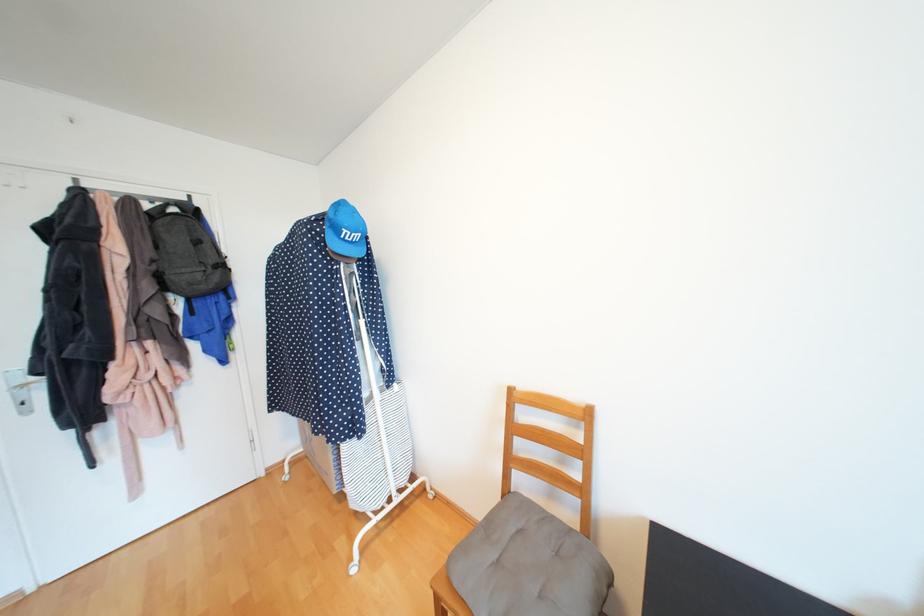
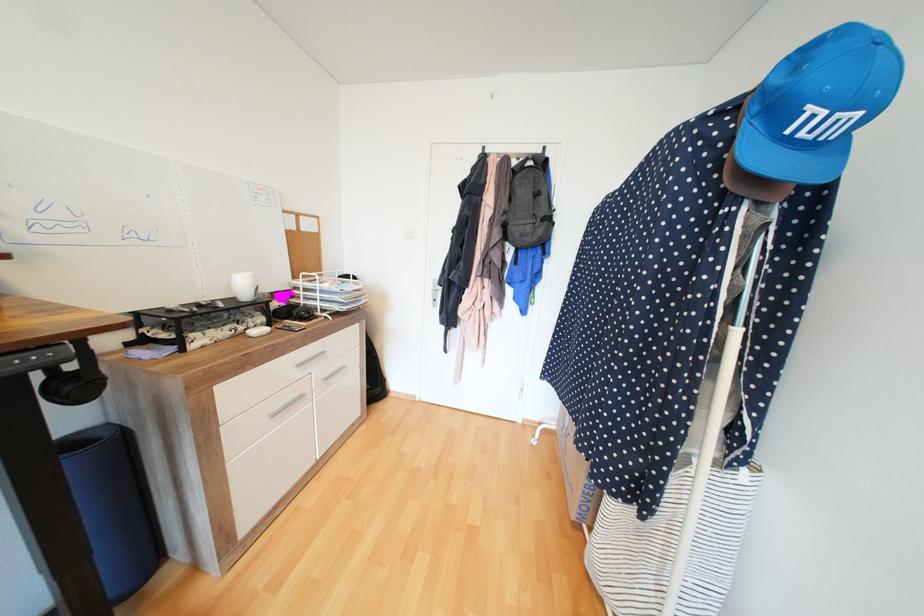
Find the pixel in the second image that matches (160,262) in the first image.

(511, 213)